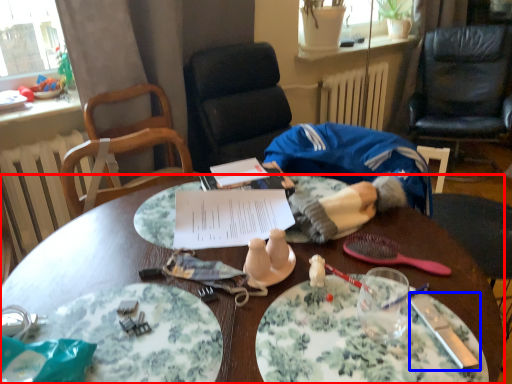
Question: Which point is further to the camera, desk (highlighted by a red box) or knife (highlighted by a blue box)?

Choices:
 (A) desk
 (B) knife

Answer: (B)